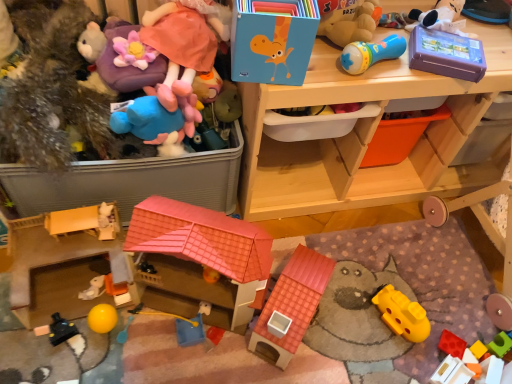
Where is `vacant location behind white plastic toy at lower right, the twelfth toy from the left`? The image size is (512, 384). vacant location behind white plastic toy at lower right, the twelfth toy from the left is located at coordinates (448, 322).